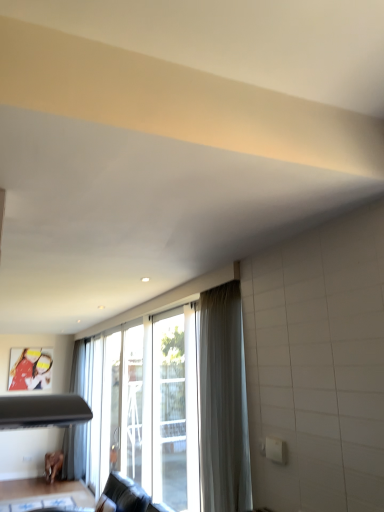
Locate an element on the screen. white sheer curtain at center is located at coordinates (223, 403).

I want to click on brown wooden table at lower left, so click(x=43, y=494).

Locate an element on the screen. The image size is (384, 512). transparent glass screen door at center, marked as the second screen door in a back-to-front arrangement is located at coordinates (169, 410).

At what (x,y) coordinates should I click in order to perform the action: click on white sheer curtain at center. Please return your answer as a coordinate pair (x, y). Looking at the image, I should click on (223, 403).

Does brown wooden table at lower left have a lesser height compared to clear glass screen door at center, marked as the 1th screen door in a back-to-front arrangement?

Indeed, brown wooden table at lower left has a lesser height compared to clear glass screen door at center, marked as the 1th screen door in a back-to-front arrangement.

Is brown wooden table at lower left touching clear glass screen door at center, which appears as the 2th screen door when viewed from the right?

brown wooden table at lower left and clear glass screen door at center, which appears as the 2th screen door when viewed from the right, are not in contact.

In the image, is brown wooden table at lower left positioned in front of or behind clear glass screen door at center, which is the first screen door in left-to-right order?

In the image, brown wooden table at lower left appears behind clear glass screen door at center, which is the first screen door in left-to-right order.

Considering the sizes of objects brown wooden table at lower left and clear glass screen door at center, which is the first screen door in left-to-right order, in the image provided, who is bigger, brown wooden table at lower left or clear glass screen door at center, which is the first screen door in left-to-right order,?

clear glass screen door at center, which is the first screen door in left-to-right order.

Does point (236, 289) appear closer or farther from the camera than point (170, 382)?

Point (236, 289).

Based on the photo, how many degrees apart are the facing directions of white sheer curtain at center and transparent glass screen door at center, marked as the second screen door in a back-to-front arrangement?

4.85 degrees.

Considering the sizes of objects white sheer curtain at center and transparent glass screen door at center, arranged as the second screen door when viewed from the left, in the image provided, who is wider, white sheer curtain at center or transparent glass screen door at center, arranged as the second screen door when viewed from the left,?

white sheer curtain at center.

From a real-world perspective, is white sheer curtain at center located beneath transparent glass screen door at center, the first screen door when ordered from right to left?

Incorrect, from a real-world perspective, white sheer curtain at center is higher than transparent glass screen door at center, the first screen door when ordered from right to left.

Which is farther from the camera, (232, 314) or (82, 504)?

Point (82, 504)

Is white sheer curtain at center located outside brown wooden table at lower left?

Yes, white sheer curtain at center is located beyond the bounds of brown wooden table at lower left.

Considering the sizes of white sheer curtain at center and brown wooden table at lower left in the image, is white sheer curtain at center wider or thinner than brown wooden table at lower left?

In the image, white sheer curtain at center appears to be more narrow than brown wooden table at lower left.

Consider the image. Is brown wooden table at lower left not within white sheer curtain at center?

Yes.

From their relative heights in the image, would you say brown wooden table at lower left is taller or shorter than white sheer curtain at center?

Considering their sizes, brown wooden table at lower left has less height than white sheer curtain at center.

Is brown wooden table at lower left positioned in front of white sheer curtain at center?

No, the depth of brown wooden table at lower left is greater than that of white sheer curtain at center.

In terms of width, does brown wooden table at lower left look wider or thinner when compared to white sheer curtain at center?

brown wooden table at lower left is wider than white sheer curtain at center.

From the image's perspective, is transparent glass screen door at center, the 1th screen door viewed from the front, on top of white sheer curtain at center?

No, from the image's perspective, transparent glass screen door at center, the 1th screen door viewed from the front, is not over white sheer curtain at center.

Relative to white sheer curtain at center, is transparent glass screen door at center, arranged as the second screen door when viewed from the left, in front or behind?

Visually, transparent glass screen door at center, arranged as the second screen door when viewed from the left, is located behind white sheer curtain at center.

Choose the correct answer: Is transparent glass screen door at center, the first screen door when ordered from right to left, inside white sheer curtain at center or outside it?

transparent glass screen door at center, the first screen door when ordered from right to left, is located beyond the bounds of white sheer curtain at center.

Between white sheer curtain at center and clear glass screen door at center, marked as the 1th screen door in a back-to-front arrangement, which one has more height?

clear glass screen door at center, marked as the 1th screen door in a back-to-front arrangement, is taller.

Considering the relative sizes of white sheer curtain at center and clear glass screen door at center, arranged as the 2th screen door when viewed from the front, in the image provided, is white sheer curtain at center thinner than clear glass screen door at center, arranged as the 2th screen door when viewed from the front,?

No, white sheer curtain at center is not thinner than clear glass screen door at center, arranged as the 2th screen door when viewed from the front.

How different are the orientations of white sheer curtain at center and clear glass screen door at center, which appears as the 2th screen door when viewed from the right, in degrees?

There is a 4.85-degree angle between the facing directions of white sheer curtain at center and clear glass screen door at center, which appears as the 2th screen door when viewed from the right.

Would you consider white sheer curtain at center to be distant from clear glass screen door at center, which appears as the 2th screen door when viewed from the right?

Yes, white sheer curtain at center and clear glass screen door at center, which appears as the 2th screen door when viewed from the right, are quite far apart.

Locate an element on the screen. This screenshot has width=384, height=512. table that appears below the transparent glass screen door at center, the 1th screen door viewed from the front (from a real-world perspective) is located at coordinates (43, 494).

In the image, is transparent glass screen door at center, the first screen door when ordered from right to left, on the left side or the right side of brown wooden table at lower left?

Clearly, transparent glass screen door at center, the first screen door when ordered from right to left, is on the right of brown wooden table at lower left in the image.

From a real-world perspective, is transparent glass screen door at center, the 1th screen door viewed from the front, physically located above or below brown wooden table at lower left?

Clearly, from a real-world perspective, transparent glass screen door at center, the 1th screen door viewed from the front, is above brown wooden table at lower left.

Could you tell me if transparent glass screen door at center, the first screen door when ordered from right to left, is turned towards brown wooden table at lower left?

No, transparent glass screen door at center, the first screen door when ordered from right to left, is not aimed at brown wooden table at lower left.

You are a GUI agent. You are given a task and a screenshot of the screen. Output one action in this format:
    pyautogui.click(x=<x>, y=<y>)
    Task: Click on the table below the clear glass screen door at center, marked as the 1th screen door in a back-to-front arrangement (from a real-world perspective)
    Image resolution: width=384 pixels, height=512 pixels.
    Given the screenshot: What is the action you would take?
    pyautogui.click(x=43, y=494)

You are a GUI agent. You are given a task and a screenshot of the screen. Output one action in this format:
    pyautogui.click(x=<x>, y=<y>)
    Task: Click on the curtain above the transparent glass screen door at center, the 1th screen door viewed from the front (from the image's perspective)
    The height and width of the screenshot is (512, 384).
    Given the screenshot: What is the action you would take?
    pyautogui.click(x=223, y=403)

Consider the image. Looking at the image, which one is located closer to brown wooden table at lower left, clear glass screen door at center, which appears as the 2th screen door when viewed from the right, or transparent glass screen door at center, the first screen door when ordered from right to left?

clear glass screen door at center, which appears as the 2th screen door when viewed from the right.

From the image, which object appears to be nearer to brown wooden table at lower left, white sheer curtain at center or transparent glass screen door at center, the first screen door when ordered from right to left?

transparent glass screen door at center, the first screen door when ordered from right to left, is positioned closer to the anchor brown wooden table at lower left.

Consider the image. Estimate the real-world distances between objects in this image. Which object is further from white sheer curtain at center, transparent glass screen door at center, marked as the second screen door in a back-to-front arrangement, or brown wooden table at lower left?

Based on the image, brown wooden table at lower left appears to be further to white sheer curtain at center.

Considering their positions, is clear glass screen door at center, which is the first screen door in left-to-right order, positioned further to transparent glass screen door at center, the first screen door when ordered from right to left, than brown wooden table at lower left?

The object further to transparent glass screen door at center, the first screen door when ordered from right to left, is brown wooden table at lower left.

From the image, which object appears to be nearer to white sheer curtain at center, transparent glass screen door at center, the 1th screen door viewed from the front, or clear glass screen door at center, arranged as the 2th screen door when viewed from the front?

The object closer to white sheer curtain at center is transparent glass screen door at center, the 1th screen door viewed from the front.

Looking at the image, which one is located closer to brown wooden table at lower left, transparent glass screen door at center, arranged as the second screen door when viewed from the left, or white sheer curtain at center?

transparent glass screen door at center, arranged as the second screen door when viewed from the left, is closer to brown wooden table at lower left.

When comparing their distances from white sheer curtain at center, does brown wooden table at lower left or clear glass screen door at center, arranged as the 2th screen door when viewed from the front, seem closer?

The object closer to white sheer curtain at center is clear glass screen door at center, arranged as the 2th screen door when viewed from the front.

From the image, which object appears to be farther from clear glass screen door at center, which appears as the 2th screen door when viewed from the right, transparent glass screen door at center, arranged as the second screen door when viewed from the left, or white sheer curtain at center?

white sheer curtain at center is positioned further to the anchor clear glass screen door at center, which appears as the 2th screen door when viewed from the right.

This screenshot has width=384, height=512. I want to click on screen door between white sheer curtain at center and clear glass screen door at center, marked as the 1th screen door in a back-to-front arrangement, from front to back, so click(169, 410).

You are a GUI agent. You are given a task and a screenshot of the screen. Output one action in this format:
    pyautogui.click(x=<x>, y=<y>)
    Task: Click on the screen door that lies between transparent glass screen door at center, the 1th screen door viewed from the front, and brown wooden table at lower left from top to bottom
    
    Given the screenshot: What is the action you would take?
    pyautogui.click(x=110, y=406)